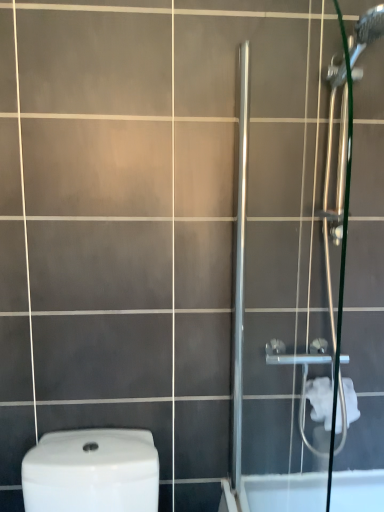
In order to click on satin chrome shower door at right in this screenshot , I will do `click(340, 272)`.

What do you see at coordinates (340, 272) in the screenshot? This screenshot has height=512, width=384. I see `satin chrome shower door at right` at bounding box center [340, 272].

The height and width of the screenshot is (512, 384). What do you see at coordinates (320, 400) in the screenshot?
I see `white soft toilet paper at right` at bounding box center [320, 400].

At what (x,y) coordinates should I click in order to perform the action: click on white soft toilet paper at right. Please return your answer as a coordinate pair (x, y). This screenshot has height=512, width=384. Looking at the image, I should click on (320, 400).

You are a GUI agent. You are given a task and a screenshot of the screen. Output one action in this format:
    pyautogui.click(x=<x>, y=<y>)
    Task: Click on the satin chrome shower door at right
    The width and height of the screenshot is (384, 512).
    Given the screenshot: What is the action you would take?
    pyautogui.click(x=340, y=272)

Which object is positioned more to the left, white soft toilet paper at right or satin chrome shower door at right?

satin chrome shower door at right.

Is white soft toilet paper at right behind satin chrome shower door at right?

Yes, it is behind satin chrome shower door at right.

Is point (310, 391) closer or farther from the camera than point (350, 84)?

Point (310, 391) is farther from the camera than point (350, 84).

From the image's perspective, which is above, white soft toilet paper at right or satin chrome shower door at right?

satin chrome shower door at right appears higher in the image.

From a real-world perspective, who is located higher, white soft toilet paper at right or satin chrome shower door at right?

satin chrome shower door at right.

Considering the sizes of objects white soft toilet paper at right and satin chrome shower door at right in the image provided, who is wider, white soft toilet paper at right or satin chrome shower door at right?

Wider between the two is white soft toilet paper at right.

Does white soft toilet paper at right have a greater height compared to satin chrome shower door at right?

No.

Considering the relative sizes of white soft toilet paper at right and satin chrome shower door at right in the image provided, is white soft toilet paper at right bigger than satin chrome shower door at right?

Actually, white soft toilet paper at right might be smaller than satin chrome shower door at right.

Would you say white soft toilet paper at right is outside satin chrome shower door at right?

Yes, white soft toilet paper at right is located beyond the bounds of satin chrome shower door at right.

Are white soft toilet paper at right and satin chrome shower door at right making contact?

No, white soft toilet paper at right is not in contact with satin chrome shower door at right.

Is white soft toilet paper at right positioned with its back to satin chrome shower door at right?

No, white soft toilet paper at right's orientation is not away from satin chrome shower door at right.

Locate an element on the screen. This screenshot has width=384, height=512. toilet paper directly beneath the satin chrome shower door at right (from a real-world perspective) is located at coordinates (320, 400).

Based on their positions, is satin chrome shower door at right located to the left or right of white soft toilet paper at right?

From the image, it's evident that satin chrome shower door at right is to the left of white soft toilet paper at right.

Considering their positions, is satin chrome shower door at right located in front of or behind white soft toilet paper at right?

In the image, satin chrome shower door at right appears in front of white soft toilet paper at right.

Between point (326, 510) and point (325, 408), which one is positioned in front?

The point (325, 408) is more forward.

From the image's perspective, which one is positioned higher, satin chrome shower door at right or white soft toilet paper at right?

satin chrome shower door at right is shown above in the image.

From a real-world perspective, is satin chrome shower door at right located beneath white soft toilet paper at right?

Actually, satin chrome shower door at right is physically above white soft toilet paper at right in the real world.

Looking at this image, is satin chrome shower door at right wider than white soft toilet paper at right?

No.

Is satin chrome shower door at right taller or shorter than white soft toilet paper at right?

Considering their sizes, satin chrome shower door at right has more height than white soft toilet paper at right.

Does satin chrome shower door at right have a smaller size compared to white soft toilet paper at right?

No, satin chrome shower door at right is not smaller than white soft toilet paper at right.

Is satin chrome shower door at right not within white soft toilet paper at right?

satin chrome shower door at right is positioned outside white soft toilet paper at right.

Is satin chrome shower door at right not close to white soft toilet paper at right?

satin chrome shower door at right is near white soft toilet paper at right, not far away.

Is satin chrome shower door at right looking in the opposite direction of white soft toilet paper at right?

Absolutely, satin chrome shower door at right is directed away from white soft toilet paper at right.

Identify the location of toilet paper on the right side of satin chrome shower door at right. (320, 400).

This screenshot has height=512, width=384. Find the location of `toilet paper lying below the satin chrome shower door at right (from the image's perspective)`. toilet paper lying below the satin chrome shower door at right (from the image's perspective) is located at coordinates (320, 400).

Find the location of a particular element. toilet paper below the satin chrome shower door at right (from a real-world perspective) is located at coordinates (320, 400).